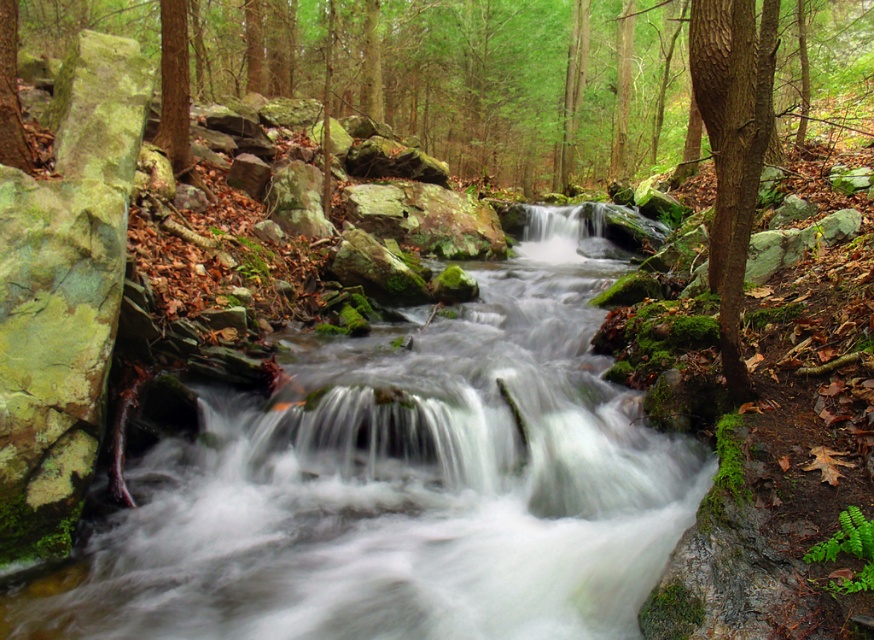
You are a hiker navigating through the forest and want to cross the clear water stream at center. Based on the image, can you determine the exact coordinates where the stream is located to plan your crossing?

The clear water stream at center is located at point [406,486], so you should aim for that coordinate to cross safely.

Consider the image. You are a hiker trying to cross the forest stream. You see two points marked on the image, point 1 at coordinates point (213, 458) and point 2 at coordinates point (713, 64). Which point is closer to you as you stand on the bank?

Point (213, 458) is in front of point (713, 64), so it is closer to you as you stand on the bank.